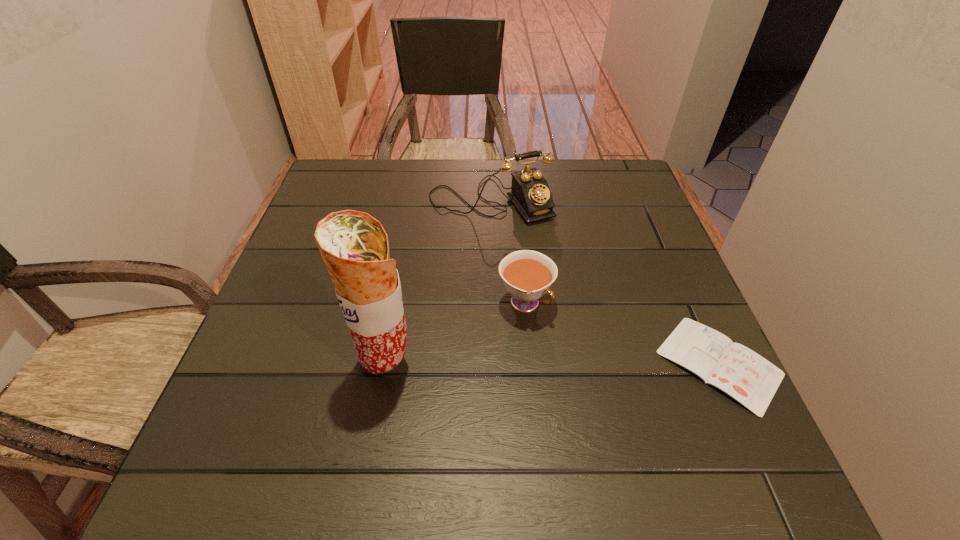
Find the location of a particular element. This screenshot has height=540, width=960. blank region between the third tallest object and the burrito is located at coordinates (456, 333).

What are the coordinates of `free space between the third shortest object and the teacup` in the screenshot? It's located at (508, 252).

Find the location of a particular element. Image resolution: width=960 pixels, height=540 pixels. free space between the tallest object and the third tallest object is located at coordinates (456, 333).

At what (x,y) coordinates should I click in order to perform the action: click on object that is the second nearest to the farthest object. Please return your answer as a coordinate pair (x, y). This screenshot has width=960, height=540. Looking at the image, I should click on (750, 379).

Locate an element on the screen. the third closest object to the diary is located at coordinates (354, 246).

This screenshot has width=960, height=540. What are the coordinates of `vacant area in the image that satisfies the following two spatial constraints: 1. on the back side of the telephone; 2. on the left side of the tallest object` in the screenshot? It's located at (416, 200).

This screenshot has height=540, width=960. In order to click on vacant space that satisfies the following two spatial constraints: 1. on the front side of the farthest object; 2. on the right side of the teacup in this screenshot , I will do `click(493, 303)`.